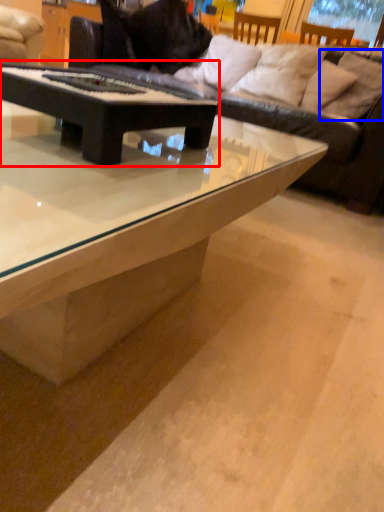
Question: Which object is closer to the camera taking this photo, coffee table (highlighted by a red box) or pillow (highlighted by a blue box)?

Choices:
 (A) coffee table
 (B) pillow

Answer: (A)